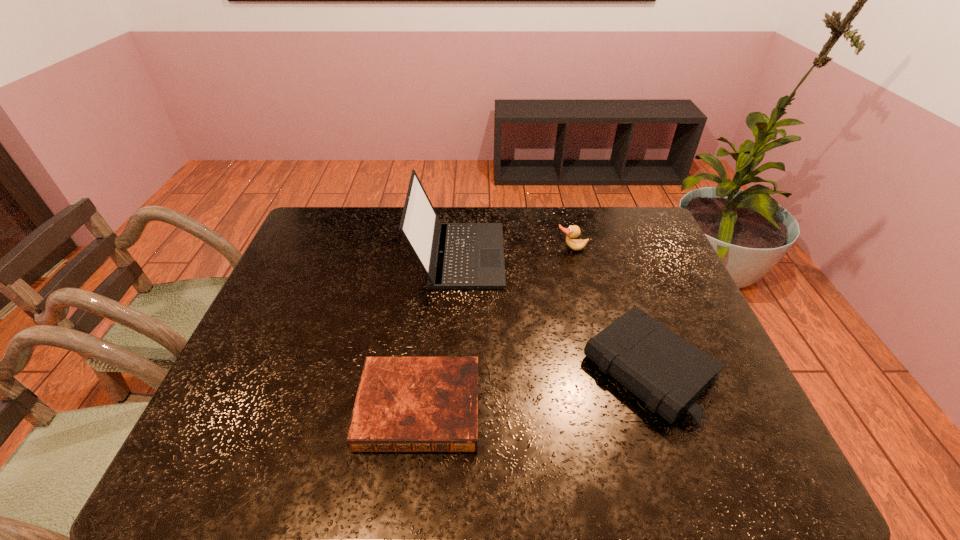
Find the location of a particular element. The width and height of the screenshot is (960, 540). empty location between the left Bible and the duck is located at coordinates (495, 328).

You are a GUI agent. You are given a task and a screenshot of the screen. Output one action in this format:
    pyautogui.click(x=<x>, y=<y>)
    Task: Click on the free space between the shortest object and the taller Bible
    The height and width of the screenshot is (540, 960).
    Given the screenshot: What is the action you would take?
    pyautogui.click(x=534, y=388)

Find the location of a particular element. This screenshot has height=540, width=960. empty space between the taller Bible and the laptop is located at coordinates 553,313.

The width and height of the screenshot is (960, 540). I want to click on unoccupied area between the shorter Bible and the laptop, so click(439, 331).

Image resolution: width=960 pixels, height=540 pixels. In order to click on empty location between the third shortest object and the tallest object in this screenshot , I will do `click(516, 252)`.

At what (x,y) coordinates should I click in order to perform the action: click on vacant area that lies between the taller Bible and the second tallest object. Please return your answer as a coordinate pair (x, y). The height and width of the screenshot is (540, 960). Looking at the image, I should click on (610, 309).

Image resolution: width=960 pixels, height=540 pixels. What are the coordinates of `unoccupied area between the taller Bible and the third shortest object` in the screenshot? It's located at (610, 309).

The image size is (960, 540). Identify the location of vacant area between the shortest object and the taller Bible. (534, 388).

Locate an element on the screen. unoccupied area between the duck and the right Bible is located at coordinates (610, 309).

The height and width of the screenshot is (540, 960). Find the location of `unoccupied position between the third shortest object and the shortest object`. unoccupied position between the third shortest object and the shortest object is located at coordinates (495, 328).